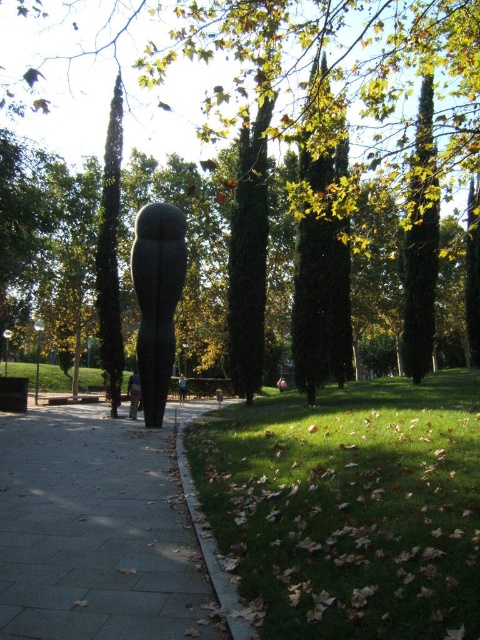
You are standing at point (96, 531) in the park. What is located at this point?

At point (96, 531) lies concrete sidewalk at center.

From the picture: You are a photographer standing at the entrance of the park, wanting to capture both the gray stone sculpture at center and the skinny jeans at center in the same frame. Based on their positions, which object will appear larger in your photo?

The gray stone sculpture at center will appear larger in the photo because it is closer to the viewer than the skinny jeans at center.